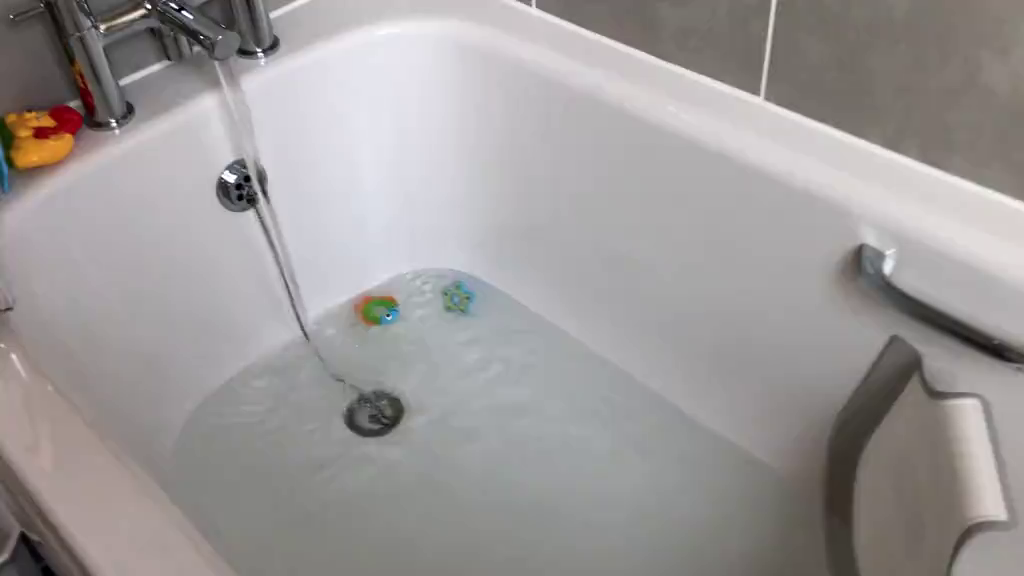
Find the location of a particular element. white bathtub is located at coordinates (388, 134).